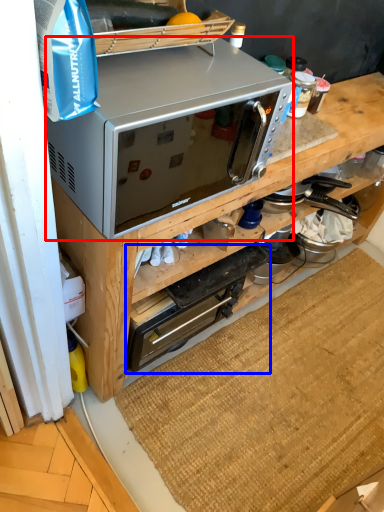
Question: Which object is closer to the camera taking this photo, microwave oven (highlighted by a red box) or appliance (highlighted by a blue box)?

Choices:
 (A) microwave oven
 (B) appliance

Answer: (A)